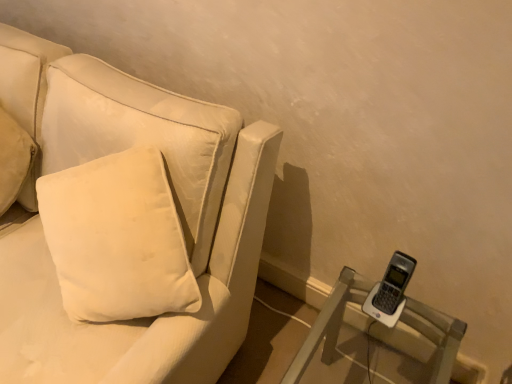
Question: Looking at the image, does velvet white couch at left seem bigger or smaller compared to white soft cushion at left?

Choices:
 (A) small
 (B) big

Answer: (B)

Question: Is point click(243, 249) positioned closer to the camera than point click(14, 52)?

Choices:
 (A) farther
 (B) closer

Answer: (B)

Question: Which object is positioned farthest from the white soft cushion at left?

Choices:
 (A) velvet white couch at left
 (B) clear plastic phone at lower right

Answer: (B)

Question: Which object is the closest to the clear plastic phone at lower right?

Choices:
 (A) white soft cushion at left
 (B) velvet white couch at left

Answer: (B)